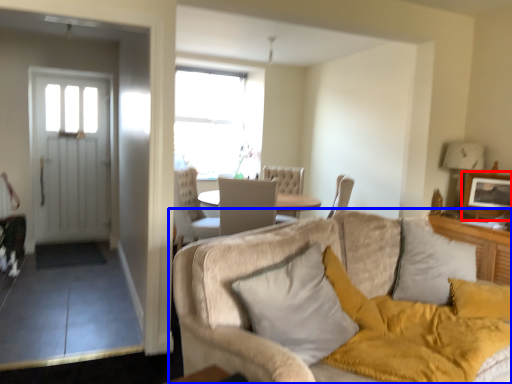
Question: Which of the following is the farthest to the observer, picture frame (highlighted by a red box) or studio couch (highlighted by a blue box)?

Choices:
 (A) picture frame
 (B) studio couch

Answer: (A)